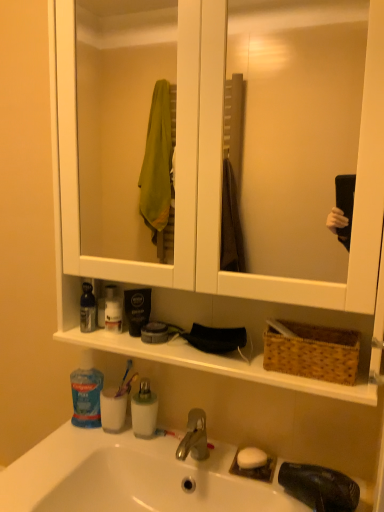
Locate an element on the screen. free location to the left of white opaque bottle at center, which is the first mouthwash in right-to-left order is located at coordinates (76, 450).